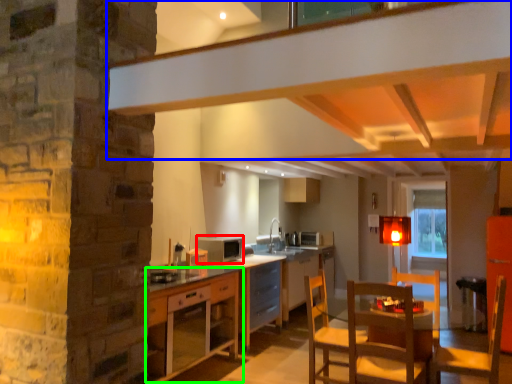
Question: Which object is the closest to the appliance (highlighted by a red box)? Choose among these: exhaust hood (highlighted by a blue box) or cabinetry (highlighted by a green box).

Choices:
 (A) exhaust hood
 (B) cabinetry

Answer: (B)